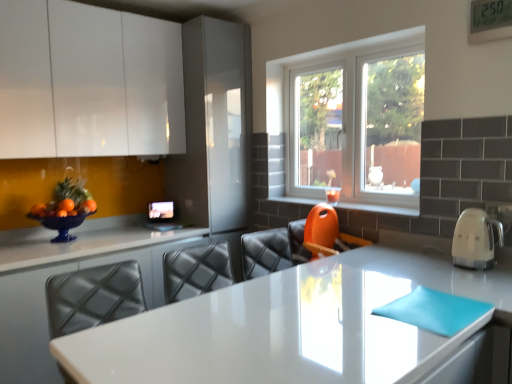
What do you see at coordinates (88, 82) in the screenshot? The image size is (512, 384). I see `white glossy cabinet at upper left` at bounding box center [88, 82].

This screenshot has height=384, width=512. Describe the element at coordinates (64, 272) in the screenshot. I see `white glossy countertop at center, which is the first countertop in back-to-front order` at that location.

Where is `white glossy cabinet at upper left`? This screenshot has width=512, height=384. white glossy cabinet at upper left is located at coordinates (88, 82).

Is point (91, 7) less distant than point (32, 273)?

No, it is not.

Considering the relative sizes of white glossy cabinet at upper left and white glossy countertop at center, which is the first countertop in back-to-front order, in the image provided, is white glossy cabinet at upper left shorter than white glossy countertop at center, which is the first countertop in back-to-front order,?

No, white glossy cabinet at upper left is not shorter than white glossy countertop at center, which is the first countertop in back-to-front order.

Considering the positions of objects white glossy cabinet at upper left and white glossy countertop at center, which ranks as the first countertop in left-to-right order, in the image provided, who is more to the left, white glossy cabinet at upper left or white glossy countertop at center, which ranks as the first countertop in left-to-right order,?

Positioned to the left is white glossy cabinet at upper left.

Consider the image. How different are the orientations of white glossy cabinet at upper left and white glossy countertop at center, which ranks as the first countertop in left-to-right order, in degrees?

0.27 degrees.

Can you confirm if white glossy countertop at center, the 2th countertop positioned from the right, is bigger than orange plastic chair at lower center?

Correct, white glossy countertop at center, the 2th countertop positioned from the right, is larger in size than orange plastic chair at lower center.

Is point (153, 248) more distant than point (303, 202)?

No, it is not.

From the image's perspective, is white glossy countertop at center, which ranks as the first countertop in left-to-right order, below orange plastic chair at lower center?

Indeed, from the image's perspective, white glossy countertop at center, which ranks as the first countertop in left-to-right order, is shown beneath orange plastic chair at lower center.

From a real-world perspective, who is located higher, white glossy countertop at center, which ranks as the first countertop in left-to-right order, or orange plastic chair at lower center?

orange plastic chair at lower center is physically above.

Between white glossy countertop at center, which is the 2th countertop in left-to-right order, and orange plastic chair at lower center, which one has larger width?

With larger width is white glossy countertop at center, which is the 2th countertop in left-to-right order.

From the image's perspective, is white glossy countertop at center, acting as the 1th countertop starting from the right, beneath orange plastic chair at lower center?

Correct, white glossy countertop at center, acting as the 1th countertop starting from the right, appears lower than orange plastic chair at lower center in the image.

Which is behind, white glossy countertop at center, which is the 2th countertop in left-to-right order, or orange plastic chair at lower center?

orange plastic chair at lower center is further away from the camera.

At what (x,y) coordinates should I click in order to perform the action: click on window sill that appears behind the white glossy countertop at center, which ranks as the first countertop in front-to-back order. Please return your answer as a coordinate pair (x, y). The height and width of the screenshot is (384, 512). Looking at the image, I should click on (379, 208).

Is clear glass window at center positioned with its back to white glossy countertop at center, which ranks as the first countertop in front-to-back order?

No, clear glass window at center is not facing away from white glossy countertop at center, which ranks as the first countertop in front-to-back order.

Is point (415, 200) closer to camera compared to point (436, 262)?

That is False.

Considering the positions of objects clear glass window at center and white glossy countertop at center, acting as the 1th countertop starting from the right, in the image provided, who is behind, clear glass window at center or white glossy countertop at center, acting as the 1th countertop starting from the right,?

clear glass window at center is further from the camera.

Considering the sizes of objects white glossy cabinet at upper left and clear glass window at center in the image provided, who is shorter, white glossy cabinet at upper left or clear glass window at center?

With less height is white glossy cabinet at upper left.

Is point (72, 148) less distant than point (378, 149)?

Yes, it is in front of point (378, 149).

You are a GUI agent. You are given a task and a screenshot of the screen. Output one action in this format:
    pyautogui.click(x=<x>, y=<y>)
    Task: Click on the cabinetry above the clear glass window at center (from a real-world perspective)
    The height and width of the screenshot is (384, 512).
    Given the screenshot: What is the action you would take?
    pyautogui.click(x=88, y=82)

How many degrees apart are the facing directions of white glossy cabinet at upper left and clear glass window at center?

The angular difference between white glossy cabinet at upper left and clear glass window at center is 90.4 degrees.

Is white glossy cabinet at upper left oriented towards orange plastic chair at lower center?

No, white glossy cabinet at upper left is not aimed at orange plastic chair at lower center.

Does point (124, 42) appear closer or farther from the camera than point (417, 200)?

Point (124, 42) appears to be farther away from the viewer than point (417, 200).

Is orange plastic chair at lower center a part of white glossy cabinet at upper left?

Definitely not — orange plastic chair at lower center is not inside white glossy cabinet at upper left.

Does white glossy cabinet at upper left come in front of white glossy kettle at right?

No, it is behind white glossy kettle at right.

Is white glossy cabinet at upper left positioned beyond the bounds of white glossy kettle at right?

Yes, white glossy cabinet at upper left is not within white glossy kettle at right.

From the image's perspective, is white glossy cabinet at upper left on top of white glossy kettle at right?

Yes, from the image's perspective, white glossy cabinet at upper left is on top of white glossy kettle at right.

Is white glossy cabinet at upper left wider than white glossy kettle at right?

Correct, the width of white glossy cabinet at upper left exceeds that of white glossy kettle at right.

From the white glossy cabinet at upper left, count 1st countertops forward and point to it. Please provide its 2D coordinates.

[(64, 272)]

You are a GUI agent. You are given a task and a screenshot of the screen. Output one action in this format:
    pyautogui.click(x=<x>, y=<y>)
    Task: Click on the countertop that is the 2nd one below the orange plastic chair at lower center (from a real-world perspective)
    The image size is (512, 384).
    Given the screenshot: What is the action you would take?
    pyautogui.click(x=64, y=272)

From the image, which object appears to be nearer to white glossy kettle at right, white glossy countertop at center, which ranks as the first countertop in left-to-right order, or white glossy cabinet at upper left?

Among the two, white glossy countertop at center, which ranks as the first countertop in left-to-right order, is located nearer to white glossy kettle at right.

From the image, which object appears to be nearer to white glossy countertop at center, which ranks as the first countertop in front-to-back order, clear glass window at center or white glossy kettle at right?

The object closer to white glossy countertop at center, which ranks as the first countertop in front-to-back order, is white glossy kettle at right.

Which object lies further to the anchor point white glossy countertop at center, the 2th countertop positioned from the right, clear glass window at center or white glossy cabinet at upper left?

clear glass window at center is positioned further to the anchor white glossy countertop at center, the 2th countertop positioned from the right.

Considering their positions, is white glossy countertop at center, the second countertop when ordered from back to front, positioned closer to white glossy kettle at right than white glossy countertop at center, which ranks as the first countertop in left-to-right order?

The object closer to white glossy kettle at right is white glossy countertop at center, the second countertop when ordered from back to front.

When comparing their distances from white glossy cabinet at upper left, does white glossy kettle at right or clear glass window at center seem closer?

clear glass window at center.

Which object lies nearer to the anchor point clear glass window at center, white glossy cabinet at upper left or orange plastic chair at lower center?

orange plastic chair at lower center is positioned closer to the anchor clear glass window at center.

Which object lies further to the anchor point white glossy countertop at center, which ranks as the first countertop in front-to-back order, white glossy cabinet at upper left or clear glass window at center?

Based on the image, white glossy cabinet at upper left appears to be further to white glossy countertop at center, which ranks as the first countertop in front-to-back order.

Estimate the real-world distances between objects in this image. Which object is closer to orange plastic chair at lower center, white glossy countertop at center, the second countertop when ordered from front to back, or white glossy kettle at right?

Based on the image, white glossy kettle at right appears to be nearer to orange plastic chair at lower center.

Where is `window sill located between white glossy countertop at center, which is the first countertop in back-to-front order, and white glossy kettle at right in the left-right direction`? window sill located between white glossy countertop at center, which is the first countertop in back-to-front order, and white glossy kettle at right in the left-right direction is located at coordinates (379, 208).

Identify the location of countertop between white glossy countertop at center, acting as the 1th countertop starting from the right, and clear glass window at center from front to back. The width and height of the screenshot is (512, 384). (64, 272).

You are a GUI agent. You are given a task and a screenshot of the screen. Output one action in this format:
    pyautogui.click(x=<x>, y=<y>)
    Task: Click on the window between white glossy countertop at center, the 2th countertop positioned from the right, and white glossy kettle at right, in the horizontal direction
    The width and height of the screenshot is (512, 384).
    Given the screenshot: What is the action you would take?
    pyautogui.click(x=354, y=120)

I want to click on coffee machine between white glossy countertop at center, which ranks as the first countertop in front-to-back order, and orange plastic chair at lower center in the front-back direction, so click(475, 239).